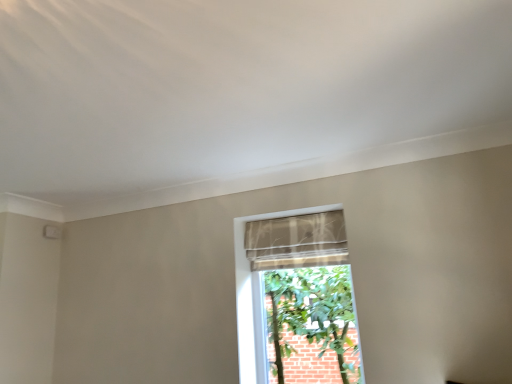
Question: Is beige textured fabric at center to the left or to the right of sheer fabric curtain at center in the image?

Choices:
 (A) left
 (B) right

Answer: (B)

Question: From a real-world perspective, relative to sheer fabric curtain at center, is beige textured fabric at center vertically above or below?

Choices:
 (A) below
 (B) above

Answer: (A)

Question: From the image's perspective, is beige textured fabric at center located above or below sheer fabric curtain at center?

Choices:
 (A) below
 (B) above

Answer: (A)

Question: From a real-world perspective, relative to beige textured fabric at center, is sheer fabric curtain at center vertically above or below?

Choices:
 (A) above
 (B) below

Answer: (A)

Question: Is sheer fabric curtain at center bigger or smaller than beige textured fabric at center?

Choices:
 (A) small
 (B) big

Answer: (A)

Question: Would you say sheer fabric curtain at center is to the left or to the right of beige textured fabric at center in the picture?

Choices:
 (A) left
 (B) right

Answer: (A)

Question: Is sheer fabric curtain at center wider or thinner than beige textured fabric at center?

Choices:
 (A) thin
 (B) wide

Answer: (B)